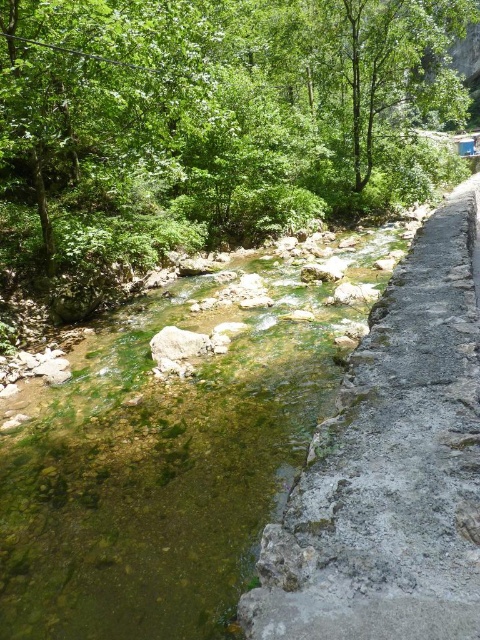
Question: Which point is closer to the camera taking this photo?

Choices:
 (A) (466, 552)
 (B) (132, 634)

Answer: (A)

Question: Among these objects, which one is farthest from the camera?

Choices:
 (A) gray stone path at right
 (B) clear water at center

Answer: (B)

Question: In this image, where is clear water at center located relative to gray stone path at right?

Choices:
 (A) above
 (B) below

Answer: (B)

Question: Where is clear water at center located in relation to gray stone path at right in the image?

Choices:
 (A) above
 (B) below

Answer: (B)

Question: Can you confirm if clear water at center is wider than gray stone path at right?

Choices:
 (A) no
 (B) yes

Answer: (B)